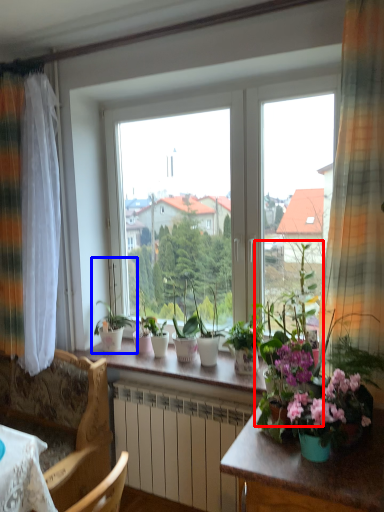
Question: Which object appears farthest to the camera in this image, houseplant (highlighted by a red box) or houseplant (highlighted by a blue box)?

Choices:
 (A) houseplant
 (B) houseplant

Answer: (B)